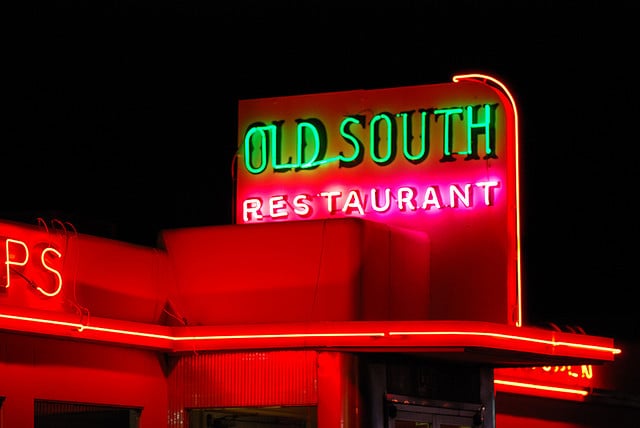
The image size is (640, 428). Identify the location of window in door. (404, 426).